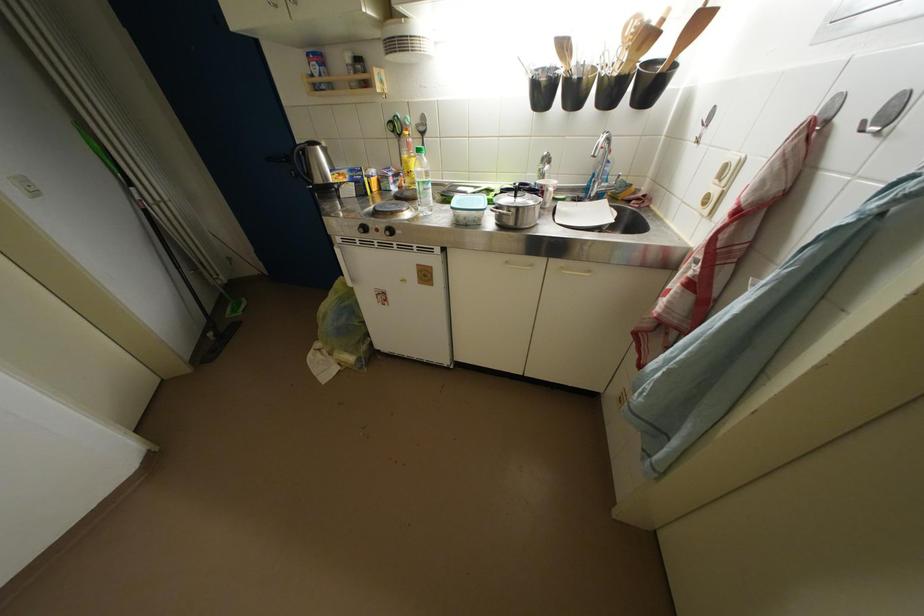
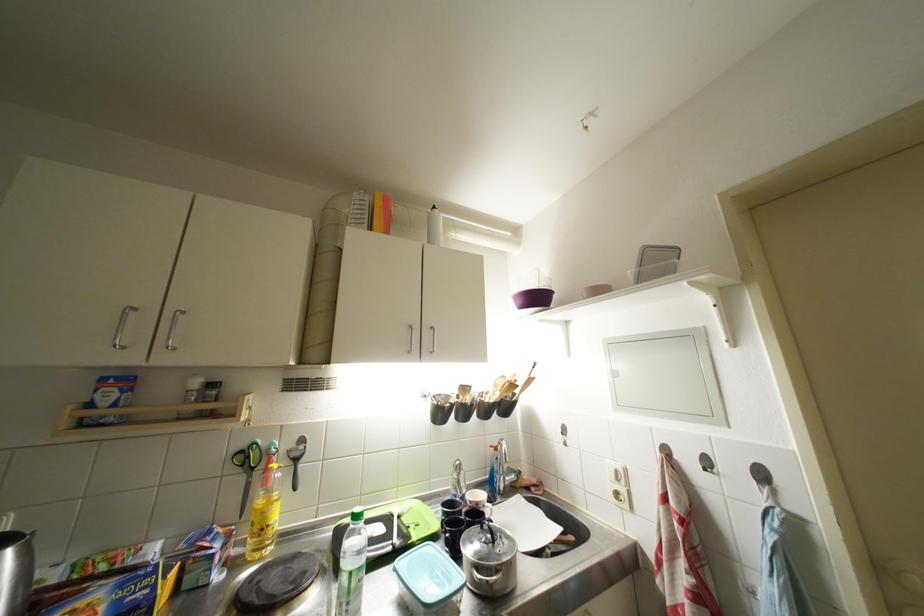
Locate, in the second image, the point that corresponds to the point at 412,167 in the first image.

(271, 517)